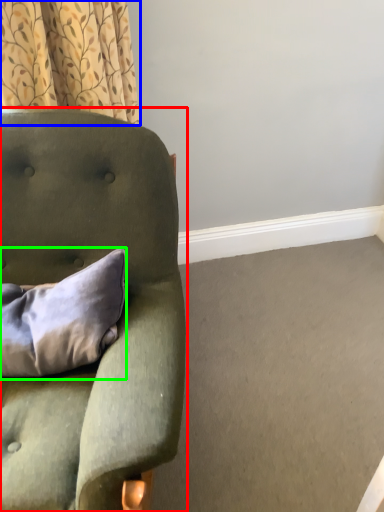
Question: Which object is the closest to the chair (highlighted by a red box)? Choose among these: curtain (highlighted by a blue box) or pillow (highlighted by a green box).

Choices:
 (A) curtain
 (B) pillow

Answer: (B)